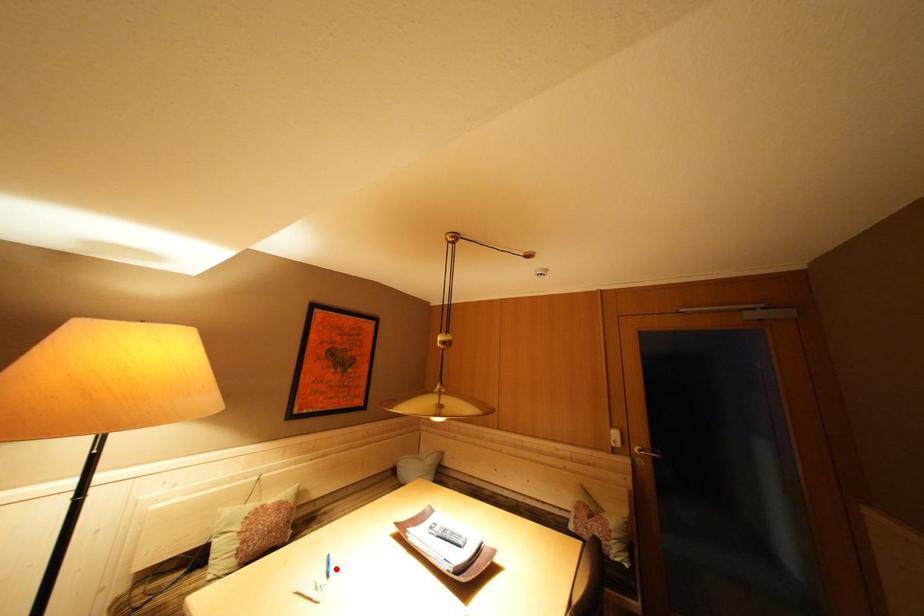
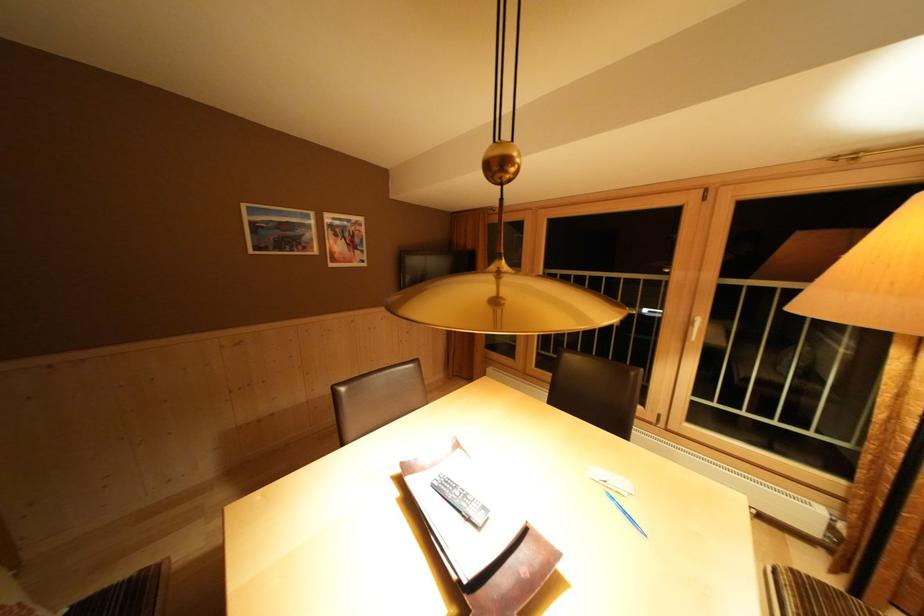
Find the pixel in the second image that matches the highlighted location in the first image.

(633, 517)